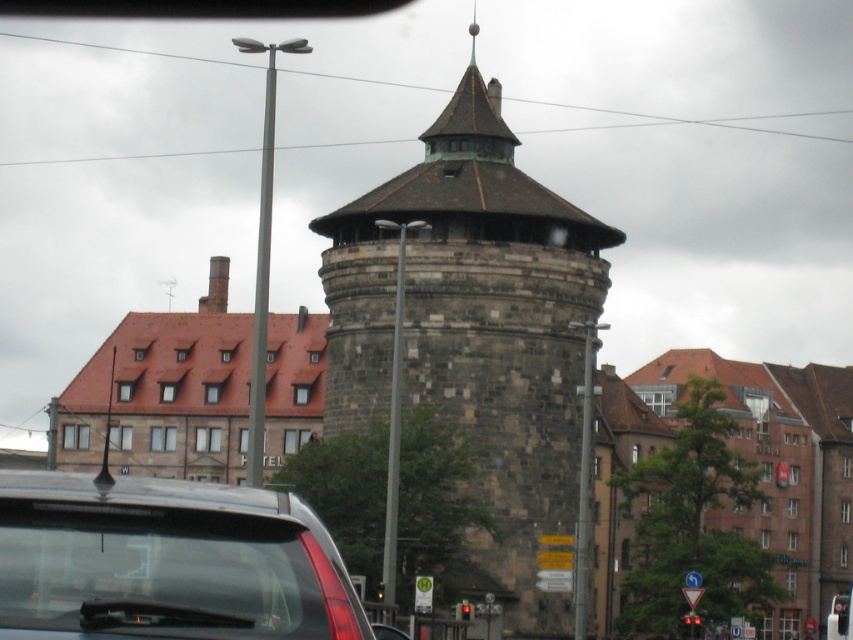
Question: Is brown stone tower at center smaller than transparent glass car at lower left?

Choices:
 (A) yes
 (B) no

Answer: (B)

Question: Can you confirm if brown stone tower at center is positioned below transparent glass car at lower left?

Choices:
 (A) no
 (B) yes

Answer: (A)

Question: Which point is farther from the camera taking this photo?

Choices:
 (A) (418, 180)
 (B) (225, 525)

Answer: (A)

Question: Is brown stone tower at center above transparent glass car at lower left?

Choices:
 (A) yes
 (B) no

Answer: (A)